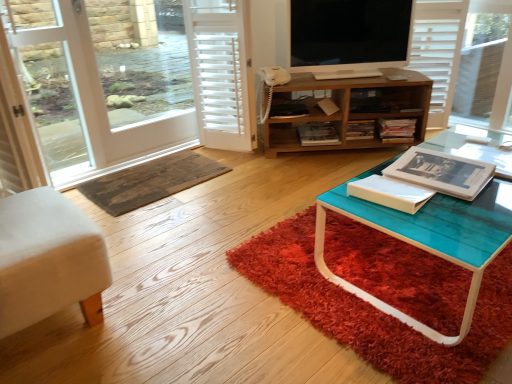
The height and width of the screenshot is (384, 512). I want to click on vacant location behind white fabric cushion at lower left, so [132, 236].